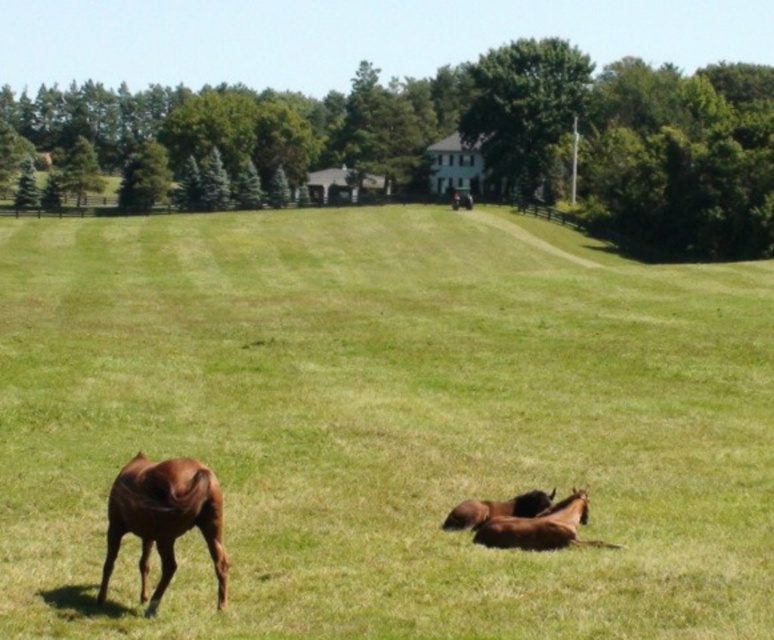
Question: Is green grass pasture at center smaller than brown glossy horse at lower left?

Choices:
 (A) no
 (B) yes

Answer: (A)

Question: Is brown glossy horse at lower right below brown glossy horse at lower center?

Choices:
 (A) no
 (B) yes

Answer: (B)

Question: From the image, what is the correct spatial relationship of brown glossy horse at lower right in relation to brown glossy horse at lower center?

Choices:
 (A) below
 (B) above

Answer: (A)

Question: Which of the following is the closest to the observer?

Choices:
 (A) (98, 588)
 (B) (461, 509)
 (C) (245, 294)

Answer: (A)

Question: Which object is positioned farthest from the brown glossy horse at lower right?

Choices:
 (A) brown glossy horse at lower left
 (B) brown glossy horse at lower center
 (C) green grass pasture at center

Answer: (C)

Question: Which object appears farthest from the camera in this image?

Choices:
 (A) brown glossy horse at lower right
 (B) brown glossy horse at lower left
 (C) green grass pasture at center
 (D) brown glossy horse at lower center

Answer: (D)